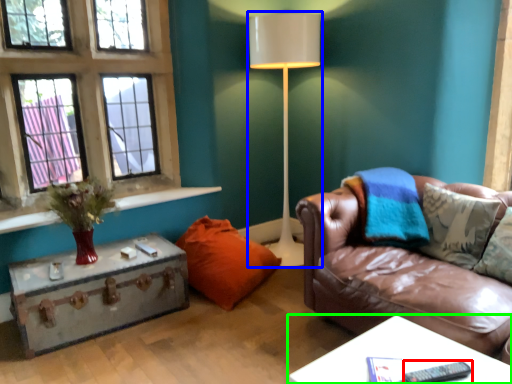
Question: Estimate the real-world distances between objects in this image. Which object is closer to remote (highlighted by a red box), lamp (highlighted by a blue box) or table (highlighted by a green box)?

Choices:
 (A) lamp
 (B) table

Answer: (B)